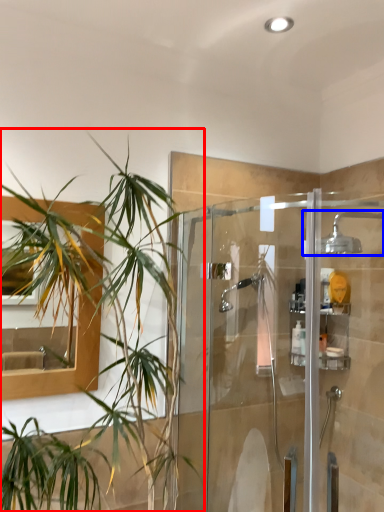
Question: Which point is further to the camera, houseplant (highlighted by a red box) or shower (highlighted by a blue box)?

Choices:
 (A) houseplant
 (B) shower

Answer: (B)